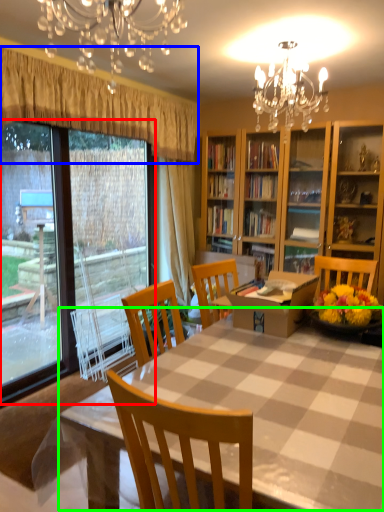
Question: Which object is the farthest from bay window (highlighted by a red box)? Choose among these: curtain (highlighted by a blue box) or kitchen & dining room table (highlighted by a green box).

Choices:
 (A) curtain
 (B) kitchen & dining room table

Answer: (B)